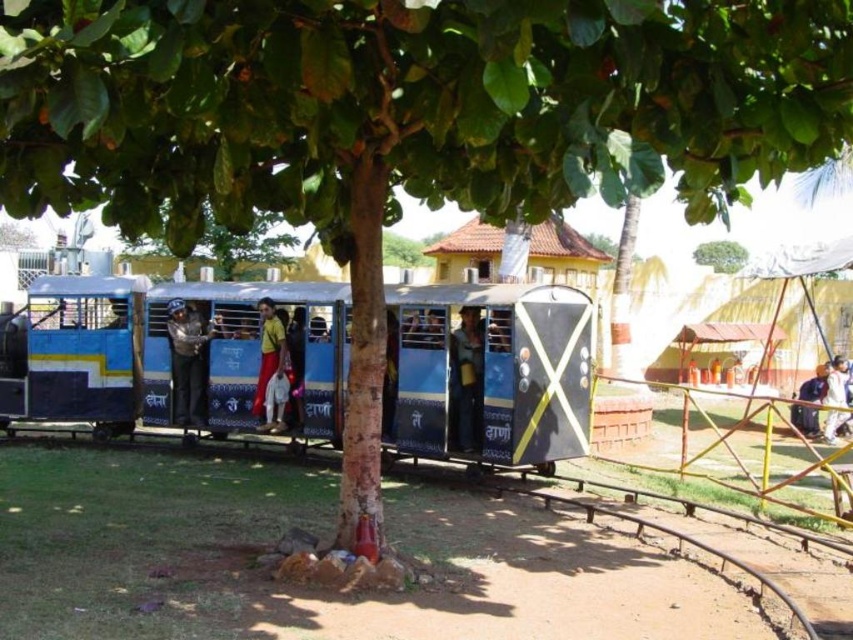
The height and width of the screenshot is (640, 853). Identify the location of dark blue fabric shirt at right. (814, 385).

Measure the distance between dark blue fabric shirt at right and green leafy tree at center.

dark blue fabric shirt at right is 11.72 meters from green leafy tree at center.

Is point (804, 406) positioned in front of point (717, 253)?

That is True.

Find the location of a particular element. This screenshot has width=853, height=640. dark blue fabric shirt at right is located at coordinates (814, 385).

Does blue painted metal train at center lie behind white fabric at right?

That is False.

Can you confirm if blue painted metal train at center is smaller than white fabric at right?

Actually, blue painted metal train at center might be larger than white fabric at right.

Does point (61, 396) lie in front of point (827, 432)?

Yes, point (61, 396) is closer to viewer.

You are a GUI agent. You are given a task and a screenshot of the screen. Output one action in this format:
    pyautogui.click(x=<x>, y=<y>)
    Task: Click on the blue painted metal train at center
    Image resolution: width=853 pixels, height=640 pixels.
    Given the screenshot: What is the action you would take?
    pyautogui.click(x=173, y=353)

Does dark blue uniform at center have a lesser width compared to green leafy tree at center?

Yes.

Between dark blue uniform at center and green leafy tree at center, which one has less height?

Standing shorter between the two is green leafy tree at center.

Where is `dark blue uniform at center`? The image size is (853, 640). dark blue uniform at center is located at coordinates (187, 362).